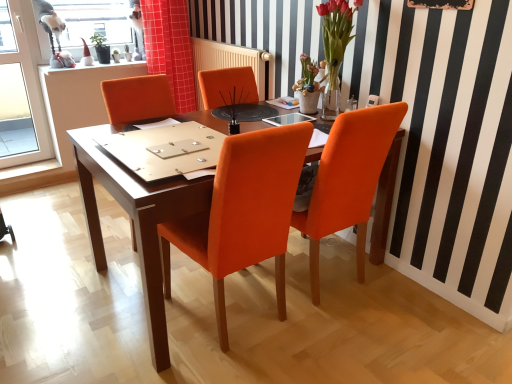
Question: Which direction should I rotate to look at orange leather chair at center, which ranks as the 2th chair in right-to-left order?

Choices:
 (A) left
 (B) right

Answer: (A)

Question: Are matte wood desk at center and translucent glass vase at upper right located far from each other?

Choices:
 (A) yes
 (B) no

Answer: (A)

Question: Considering the relative sizes of matte wood desk at center and translucent glass vase at upper right in the image provided, is matte wood desk at center taller than translucent glass vase at upper right?

Choices:
 (A) yes
 (B) no

Answer: (A)

Question: Is matte wood desk at center closer to camera compared to translucent glass vase at upper right?

Choices:
 (A) no
 (B) yes

Answer: (B)

Question: Is translucent glass vase at upper right located within matte wood desk at center?

Choices:
 (A) yes
 (B) no

Answer: (B)

Question: Is matte wood desk at center to the left of translucent glass vase at upper right from the viewer's perspective?

Choices:
 (A) yes
 (B) no

Answer: (A)

Question: Is matte wood desk at center at the right side of translucent glass vase at upper right?

Choices:
 (A) no
 (B) yes

Answer: (A)

Question: Is orange leather chair at center, which is the 1th chair from left to right, oriented away from wooden bulletin board at upper center?

Choices:
 (A) no
 (B) yes

Answer: (A)

Question: Considering the relative sizes of orange leather chair at center, which is the 1th chair from left to right, and wooden bulletin board at upper center in the image provided, is orange leather chair at center, which is the 1th chair from left to right, smaller than wooden bulletin board at upper center?

Choices:
 (A) yes
 (B) no

Answer: (B)

Question: Can you confirm if orange leather chair at center, which ranks as the 2th chair in right-to-left order, is bigger than wooden bulletin board at upper center?

Choices:
 (A) yes
 (B) no

Answer: (A)

Question: Is orange leather chair at center, which ranks as the 2th chair in right-to-left order, wider than wooden bulletin board at upper center?

Choices:
 (A) no
 (B) yes

Answer: (B)

Question: Is the position of orange leather chair at center, which is the 1th chair from left to right, less distant than that of wooden bulletin board at upper center?

Choices:
 (A) no
 (B) yes

Answer: (B)

Question: Is orange leather chair at center, which ranks as the 2th chair in right-to-left order, not within wooden bulletin board at upper center?

Choices:
 (A) yes
 (B) no

Answer: (A)

Question: Is wooden bulletin board at upper center closer to the viewer compared to orange leather chair at center, which is the 1th chair from left to right?

Choices:
 (A) no
 (B) yes

Answer: (A)